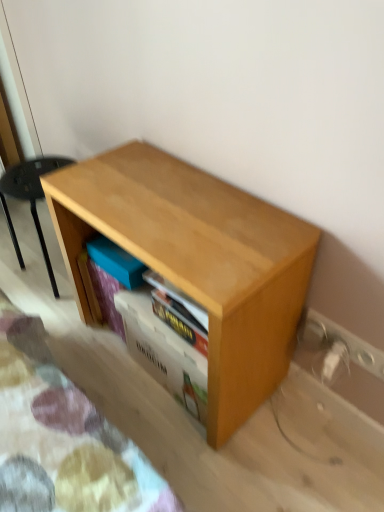
In order to click on vacant space situated on the left part of wooden shelf at center in this screenshot , I will do `click(114, 371)`.